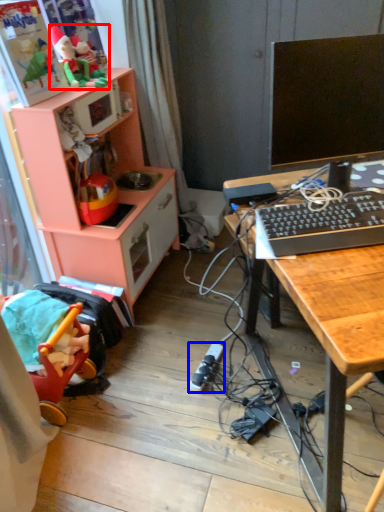
Question: Which of the following is the closest to the observer, toy (highlighted by a red box) or plug (highlighted by a blue box)?

Choices:
 (A) toy
 (B) plug

Answer: (B)